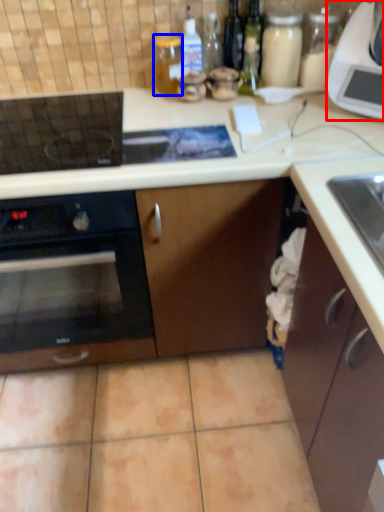
Question: Which object is further to the camera taking this photo, kitchen appliance (highlighted by a red box) or bottle (highlighted by a blue box)?

Choices:
 (A) kitchen appliance
 (B) bottle

Answer: (B)